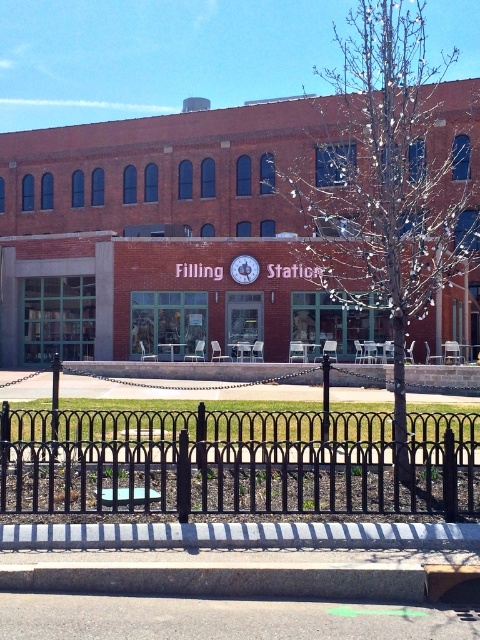
You are a customer approaching the entrance of the Filling Station building. You see the black wrought iron fence at lower center and the matte silver clock at center. Which object is closer to the entrance?

The black wrought iron fence at lower center is positioned under the matte silver clock at center, so the fence is closer to the entrance than the clock.

You are standing in front of the Filling Station building and want to enter. You see the black wrought iron fence at lower center and the matte silver clock at center. Which object is closer to the entrance?

The matte silver clock at center is closer to the entrance because the black wrought iron fence at lower center is to the right of it, meaning the clock is positioned more centrally near the entrance.

Looking at this image, you are standing in front of the brick building and want to enter the entrance. There is a black wrought iron fence at lower center blocking your path. Can you walk around it to reach the entrance?

The black wrought iron fence at lower center is 11.96 meters away from viewer, so you can walk around it to reach the entrance since it is positioned at a distance from you.